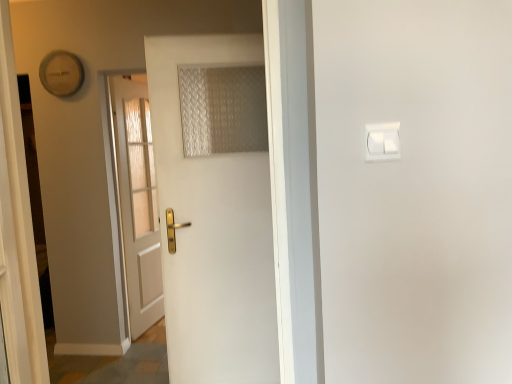
Question: In terms of height, does translucent fabric curtain at center look taller or shorter compared to white wooden door at center, the first door in the left-to-right sequence?

Choices:
 (A) short
 (B) tall

Answer: (A)

Question: Is translucent fabric curtain at center to the left or to the right of white wooden door at center, marked as the 2th door in a front-to-back arrangement, in the image?

Choices:
 (A) right
 (B) left

Answer: (A)

Question: Which object is positioned closest to the wooden clock at upper left?

Choices:
 (A) translucent fabric curtain at center
 (B) white matte door at center, placed as the 1th door when sorted from front to back
 (C) white wooden door at center, the first door in the left-to-right sequence

Answer: (C)

Question: Based on their relative distances, which object is farther from the white wooden door at center, the first door in the left-to-right sequence?

Choices:
 (A) white matte door at center, placed as the second door when sorted from left to right
 (B) wooden clock at upper left
 (C) translucent fabric curtain at center

Answer: (C)